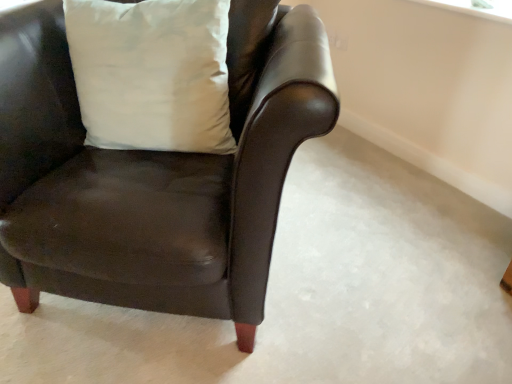
Question: From a real-world perspective, is matte black armchair at center above or below white matte pillow at upper left?

Choices:
 (A) below
 (B) above

Answer: (A)

Question: Is matte black armchair at center taller or shorter than white matte pillow at upper left?

Choices:
 (A) short
 (B) tall

Answer: (B)

Question: Is matte black armchair at center spatially inside white matte pillow at upper left, or outside of it?

Choices:
 (A) outside
 (B) inside

Answer: (A)

Question: From a real-world perspective, is white matte pillow at upper left above or below matte black armchair at center?

Choices:
 (A) below
 (B) above

Answer: (B)

Question: Is point 118,8 positioned closer to the camera than point 287,89?

Choices:
 (A) closer
 (B) farther

Answer: (B)

Question: Looking at their shapes, would you say white matte pillow at upper left is wider or thinner than matte black armchair at center?

Choices:
 (A) thin
 (B) wide

Answer: (A)

Question: Considering the positions of white matte pillow at upper left and matte black armchair at center in the image, is white matte pillow at upper left bigger or smaller than matte black armchair at center?

Choices:
 (A) big
 (B) small

Answer: (B)